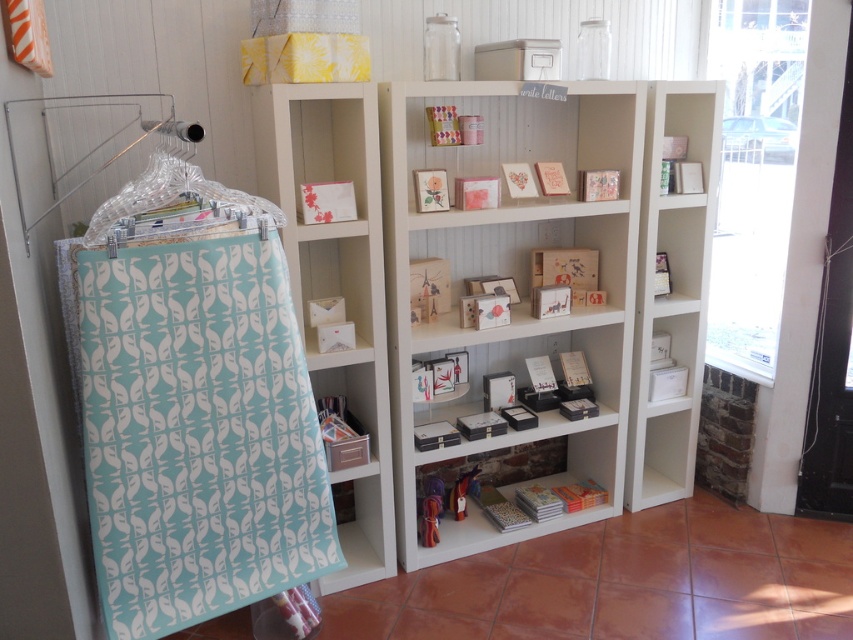
The height and width of the screenshot is (640, 853). Describe the element at coordinates (531, 276) in the screenshot. I see `white matte bookshelf at center` at that location.

Is white matte bookshelf at center below white matte shelf at center?

No, white matte bookshelf at center is not below white matte shelf at center.

Does point (622, 112) lie in front of point (366, 272)?

No, it is not.

The width and height of the screenshot is (853, 640). Find the location of `white matte bookshelf at center`. white matte bookshelf at center is located at coordinates (531, 276).

Between white matte bookshelf at center and clear plastic hanger at left, which one is positioned lower?

white matte bookshelf at center

Does point (509, 102) lie in front of point (223, 214)?

No, it is not.

I want to click on white matte bookshelf at center, so click(x=531, y=276).

Who is taller, white matte shelf at right or clear plastic hanger at left?

white matte shelf at right

Is point (697, 355) positioned after point (144, 209)?

Yes, it is.

Describe the element at coordinates (671, 291) in the screenshot. I see `white matte shelf at right` at that location.

Image resolution: width=853 pixels, height=640 pixels. I want to click on white matte shelf at right, so click(671, 291).